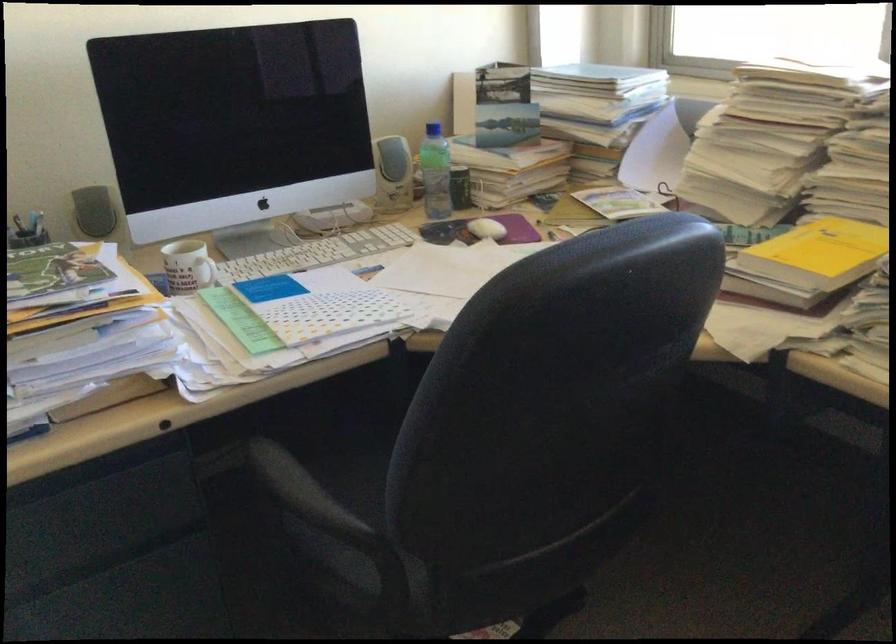
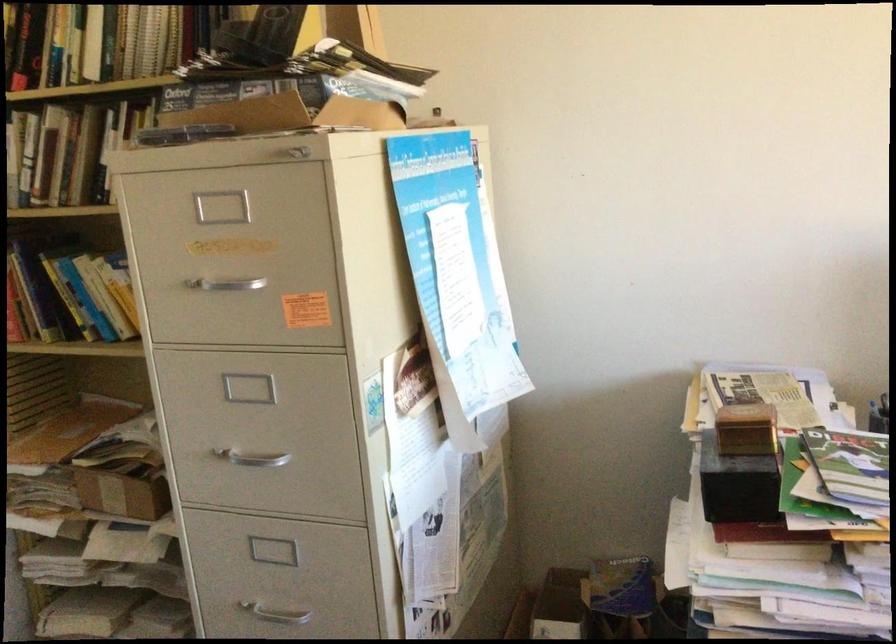
Question: The images are taken continuously from a first-person perspective. In which direction is your viewpoint rotating?

Choices:
 (A) Left
 (B) Right
 (C) Up
 (D) Down

Answer: (A)